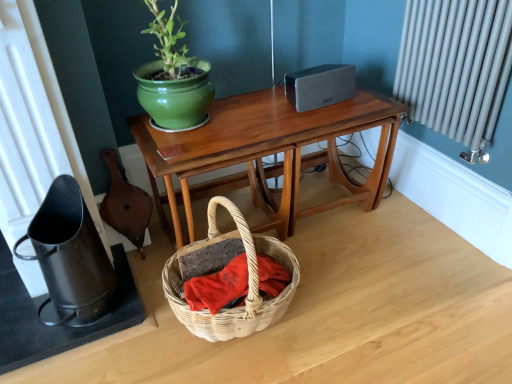
Question: Considering their positions, is woven wicker basket at lower center located in front of or behind wooden table at center?

Choices:
 (A) behind
 (B) front

Answer: (B)

Question: Considering the positions of woven wicker basket at lower center and wooden table at center in the image, is woven wicker basket at lower center bigger or smaller than wooden table at center?

Choices:
 (A) big
 (B) small

Answer: (B)

Question: From the image's perspective, is woven wicker basket at lower center located above or below wooden table at center?

Choices:
 (A) above
 (B) below

Answer: (B)

Question: Relative to woven wicker basket at lower center, is wooden table at center in front or behind?

Choices:
 (A) front
 (B) behind

Answer: (B)

Question: From a real-world perspective, is wooden table at center positioned above or below woven wicker basket at lower center?

Choices:
 (A) above
 (B) below

Answer: (A)

Question: In the image, is wooden table at center on the left side or the right side of woven wicker basket at lower center?

Choices:
 (A) left
 (B) right

Answer: (B)

Question: Is wooden table at center inside the boundaries of woven wicker basket at lower center, or outside?

Choices:
 (A) outside
 (B) inside

Answer: (A)